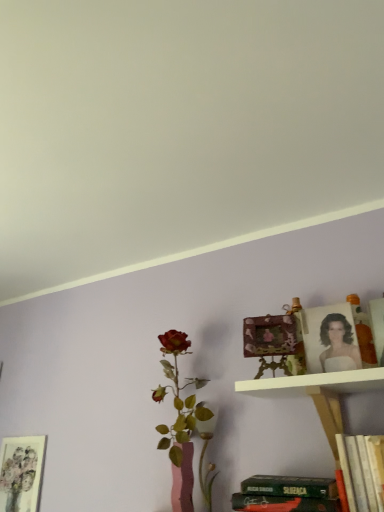
Question: Is matte floral print at lower left, the first picture frame from the back, wider than white wooden shelf at upper center?

Choices:
 (A) no
 (B) yes

Answer: (A)

Question: Is matte floral print at lower left, which is counted as the 1th picture frame, starting from the left, looking in the opposite direction of white wooden shelf at upper center?

Choices:
 (A) yes
 (B) no

Answer: (B)

Question: From the image's perspective, is matte floral print at lower left, which is counted as the third picture frame, starting from the front, under white wooden shelf at upper center?

Choices:
 (A) yes
 (B) no

Answer: (A)

Question: Is matte floral print at lower left, which is counted as the 1th picture frame, starting from the left, oriented towards white wooden shelf at upper center?

Choices:
 (A) no
 (B) yes

Answer: (A)

Question: Is matte floral print at lower left, which is counted as the third picture frame, starting from the front, to the left of white wooden shelf at upper center from the viewer's perspective?

Choices:
 (A) yes
 (B) no

Answer: (A)

Question: Do you think matte gold picture frame at upper right, the 1th picture frame when ordered from front to back, is within matte floral print at lower left, which is counted as the third picture frame, starting from the front, or outside of it?

Choices:
 (A) inside
 (B) outside

Answer: (B)

Question: In the image, is matte gold picture frame at upper right, placed as the third picture frame when sorted from back to front, on the left side or the right side of matte floral print at lower left, placed as the 3th picture frame when sorted from right to left?

Choices:
 (A) right
 (B) left

Answer: (A)

Question: From the image's perspective, is matte gold picture frame at upper right, the 1th picture frame when ordered from front to back, located above or below matte floral print at lower left, the first picture frame from the back?

Choices:
 (A) above
 (B) below

Answer: (A)

Question: In terms of height, does matte gold picture frame at upper right, the 1th picture frame in the right-to-left sequence, look taller or shorter compared to matte floral print at lower left, the first picture frame from the back?

Choices:
 (A) short
 (B) tall

Answer: (A)

Question: From their relative heights in the image, would you say wooden carved frame at upper right, acting as the second picture frame starting from the right, is taller or shorter than matte gold picture frame at upper right, arranged as the first picture frame when viewed from the top?

Choices:
 (A) short
 (B) tall

Answer: (A)

Question: From the image's perspective, is wooden carved frame at upper right, which is the 2th picture frame from front to back, above or below matte gold picture frame at upper right, placed as the third picture frame when sorted from back to front?

Choices:
 (A) above
 (B) below

Answer: (B)

Question: Considering their positions, is wooden carved frame at upper right, which is counted as the second picture frame, starting from the top, located in front of or behind matte gold picture frame at upper right, the 1th picture frame in the right-to-left sequence?

Choices:
 (A) behind
 (B) front

Answer: (A)

Question: In terms of size, does wooden carved frame at upper right, which is the 2th picture frame from front to back, appear bigger or smaller than matte gold picture frame at upper right, placed as the third picture frame when sorted from back to front?

Choices:
 (A) big
 (B) small

Answer: (A)

Question: From their relative heights in the image, would you say white matte wall at upper center is taller or shorter than matte floral print at lower left, which is counted as the third picture frame, starting from the front?

Choices:
 (A) tall
 (B) short

Answer: (B)

Question: Considering the relative positions of white matte wall at upper center and matte floral print at lower left, which is counted as the third picture frame, starting from the front, in the image provided, is white matte wall at upper center to the left or to the right of matte floral print at lower left, which is counted as the third picture frame, starting from the front,?

Choices:
 (A) right
 (B) left

Answer: (A)